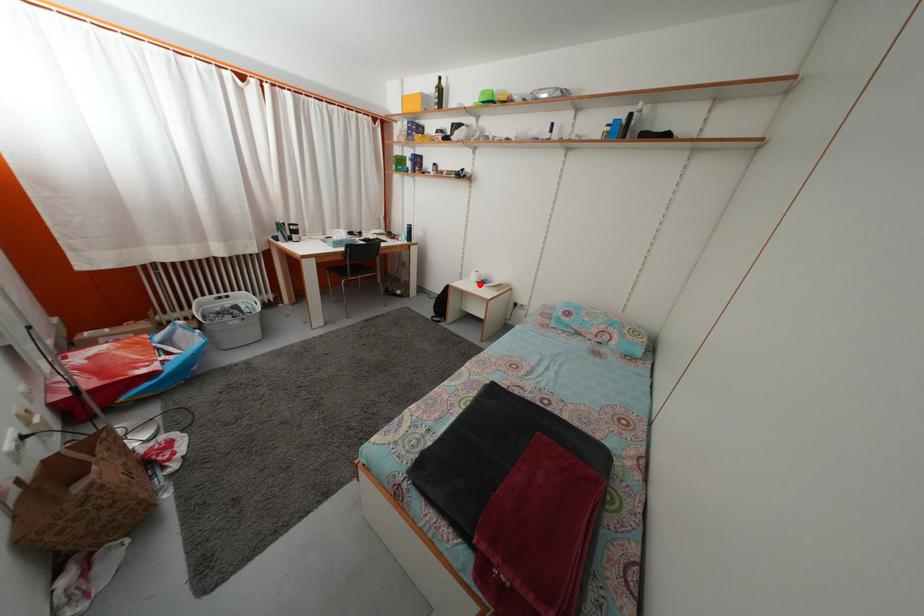
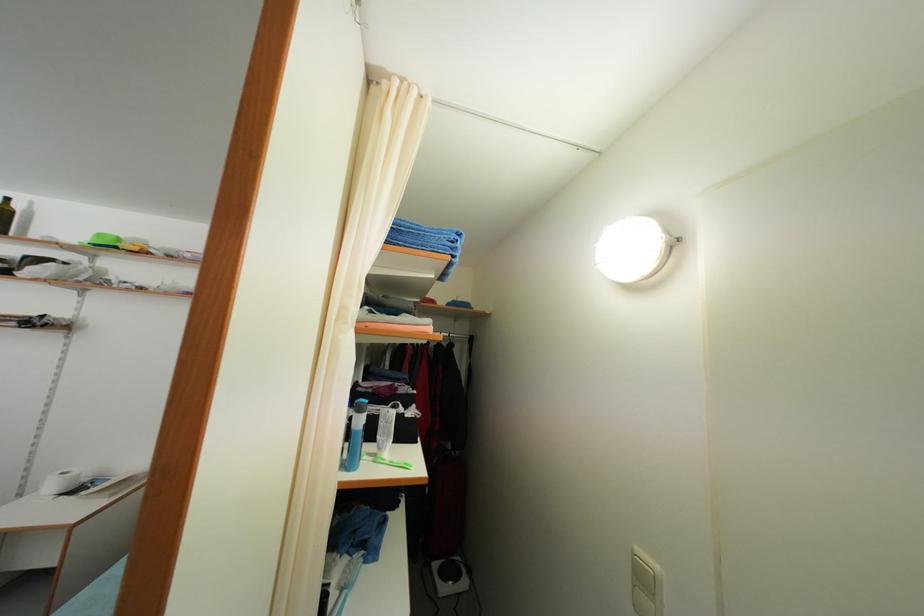
Question: I am providing you with two images of the same scene from different viewpoints. In image1, a red point is highlighted. Considering the same 3D point in image2, which of the following is correct?

Choices:
 (A) It is closer
 (B) It is farther

Answer: (A)